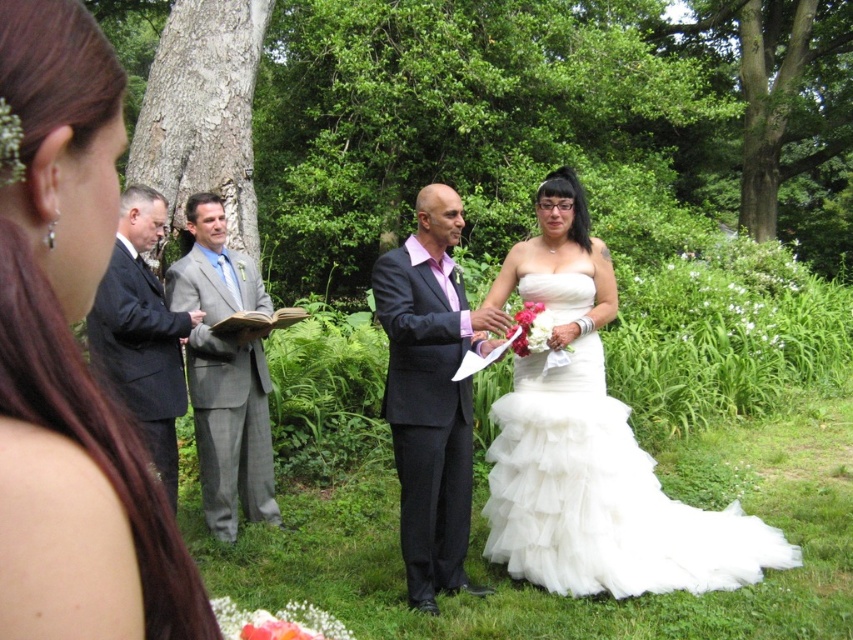
Question: Based on their relative distances, which object is nearer to the white tulle dress at center?

Choices:
 (A) white satin dress at center
 (B) matte black suit at center
 (C) gray suit at center

Answer: (B)

Question: Which object appears closest to the camera in this image?

Choices:
 (A) white satin dress at center
 (B) gray suit at center
 (C) dark gray suit at left
 (D) matte black suit at center

Answer: (A)

Question: Can you confirm if white satin dress at center is thinner than matte black suit at center?

Choices:
 (A) yes
 (B) no

Answer: (A)

Question: Where is matte black suit at center located in relation to dark gray suit at left in the image?

Choices:
 (A) right
 (B) left

Answer: (A)

Question: Is white satin dress at center closer to the viewer compared to gray suit at center?

Choices:
 (A) yes
 (B) no

Answer: (A)

Question: Estimate the real-world distances between objects in this image. Which object is closer to the matte black suit at center?

Choices:
 (A) white tulle dress at center
 (B) white satin dress at center
 (C) dark gray suit at left
 (D) gray suit at center

Answer: (A)